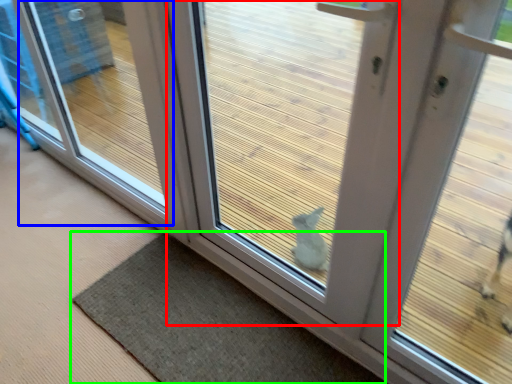
Question: Which object is positioned farthest from door (highlighted by a red box)? Select from window (highlighted by a blue box) and mat (highlighted by a green box).

Choices:
 (A) window
 (B) mat

Answer: (A)